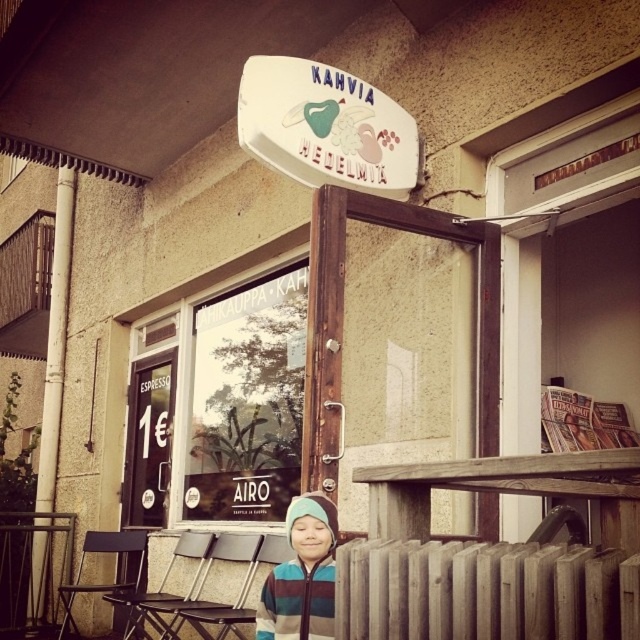
Question: Does wooden radiator at lower center appear under white plastic sign at upper center?

Choices:
 (A) yes
 (B) no

Answer: (A)

Question: Which is farther from the white plastic sign at upper center?

Choices:
 (A) striped fleece jacket at center
 (B) wooden radiator at lower center
 (C) metallic silver chair at center
 (D) metallic silver chair at lower left

Answer: (D)

Question: Is white plastic sign at upper center thinner than metallic silver chair at lower left?

Choices:
 (A) no
 (B) yes

Answer: (A)

Question: Among these objects, which one is nearest to the camera?

Choices:
 (A) metallic silver chair at center
 (B) metallic folding chair at lower left
 (C) white plastic sign at upper center

Answer: (C)

Question: Does wooden radiator at lower center have a greater width compared to white plastic sign at upper center?

Choices:
 (A) yes
 (B) no

Answer: (B)

Question: Which of the following is the farthest from the observer?

Choices:
 (A) white plastic pole at left
 (B) striped fleece jacket at center
 (C) white plastic sign at upper center
 (D) metallic folding chair at lower left

Answer: (A)